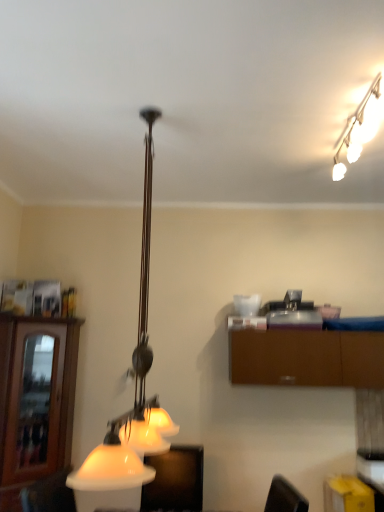
Question: Considering the relative sizes of brown wood cabinet at left, which appears as the 2th cabinetry when viewed from the right, and white glossy lamp at center, which ranks as the first lamp in left-to-right order, in the image provided, is brown wood cabinet at left, which appears as the 2th cabinetry when viewed from the right, thinner than white glossy lamp at center, which ranks as the first lamp in left-to-right order,?

Choices:
 (A) no
 (B) yes

Answer: (A)

Question: Considering the relative sizes of brown wood cabinet at left, which appears as the 2th cabinetry when viewed from the right, and white glossy lamp at center, which ranks as the first lamp in left-to-right order, in the image provided, is brown wood cabinet at left, which appears as the 2th cabinetry when viewed from the right, wider than white glossy lamp at center, which ranks as the first lamp in left-to-right order,?

Choices:
 (A) yes
 (B) no

Answer: (A)

Question: Is the depth of brown wood cabinet at left, which appears as the 2th cabinetry when viewed from the right, greater than that of white glossy lamp at center, which ranks as the first lamp in left-to-right order?

Choices:
 (A) no
 (B) yes

Answer: (B)

Question: Can you confirm if brown wood cabinet at left, which appears as the 2th cabinetry when viewed from the right, is bigger than white glossy lamp at center, the 2th lamp in the right-to-left sequence?

Choices:
 (A) no
 (B) yes

Answer: (A)

Question: Considering the relative positions of brown wood cabinet at left, which is counted as the 1th cabinetry, starting from the left, and white glossy lamp at center, the 2th lamp in the right-to-left sequence, in the image provided, is brown wood cabinet at left, which is counted as the 1th cabinetry, starting from the left, to the left of white glossy lamp at center, the 2th lamp in the right-to-left sequence, from the viewer's perspective?

Choices:
 (A) yes
 (B) no

Answer: (A)

Question: Is brown wood cabinet at left, which is counted as the 1th cabinetry, starting from the left, far from white glossy lamp at center, the 2th lamp in the right-to-left sequence?

Choices:
 (A) no
 (B) yes

Answer: (B)

Question: Is white glossy lamp at center, which ranks as the first lamp in left-to-right order, beside matte white lampshade at lower center?

Choices:
 (A) yes
 (B) no

Answer: (B)

Question: Considering the relative sizes of white glossy lamp at center, the 2th lamp in the right-to-left sequence, and matte white lampshade at lower center in the image provided, is white glossy lamp at center, the 2th lamp in the right-to-left sequence, shorter than matte white lampshade at lower center?

Choices:
 (A) no
 (B) yes

Answer: (A)

Question: Is white glossy lamp at center, the 2th lamp in the right-to-left sequence, completely or partially outside of matte white lampshade at lower center?

Choices:
 (A) no
 (B) yes

Answer: (B)

Question: From a real-world perspective, is white glossy lamp at center, which ranks as the first lamp in left-to-right order, on matte white lampshade at lower center?

Choices:
 (A) no
 (B) yes

Answer: (B)

Question: Is white glossy lamp at center, which ranks as the first lamp in left-to-right order, to the left of matte white lampshade at lower center from the viewer's perspective?

Choices:
 (A) yes
 (B) no

Answer: (A)

Question: From the image's perspective, is white glossy lamp at center, which ranks as the first lamp in left-to-right order, over matte white lampshade at lower center?

Choices:
 (A) no
 (B) yes

Answer: (B)

Question: Is matte white lampshade at lower center next to brown wood cabinet at left, which is counted as the 1th cabinetry, starting from the left?

Choices:
 (A) no
 (B) yes

Answer: (A)